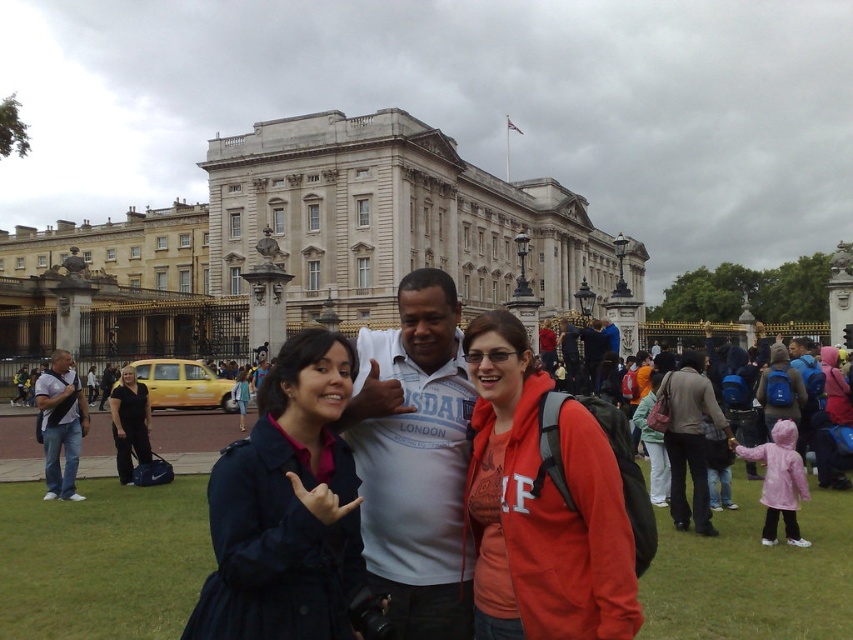
You are a photographer standing at the same spot as the tourists in the image. You want to take a photo of the white stone building at center while also including the white cotton shirt at center in the frame. Given that your camera has a maximum zoom range of 100 feet, will you be able to capture both objects in the same photo without moving?

The distance between the white stone building at center and the white cotton shirt at center is 213.53 feet. Since your camera can only zoom up to 100 feet, you won t be able to capture both objects in the same frame without moving closer or adjusting your position.

You are a photographer standing in front of the Buckingham Palace scene. You need to take a photo that includes both the white stone building at center and the dark blue coat at center. Which object should you frame first to ensure both fit in the shot?

You should frame the white stone building at center first because its width is greater than the dark blue coat at center, so capturing its full width ensures there is enough space for the smaller dark blue coat at center in the frame.

You are a photographer standing in front of the Buckingham Palace scene. You need to capture a photo that includes both the white stone building at center and the dark blue coat at center. Which object should you focus on first to ensure both are in the frame?

The white stone building at center is much taller than the dark blue coat at center, so you should focus on including the taller white stone building at center first to ensure both fit in the frame.